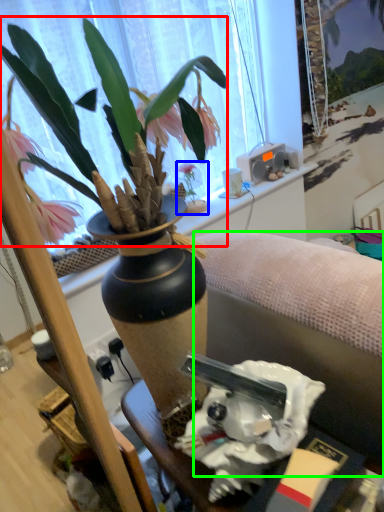
Question: Based on their relative distances, which object is farther from flower (highlighted by a red box)? Choose from houseplant (highlighted by a blue box) and studio couch (highlighted by a green box).

Choices:
 (A) houseplant
 (B) studio couch

Answer: (A)